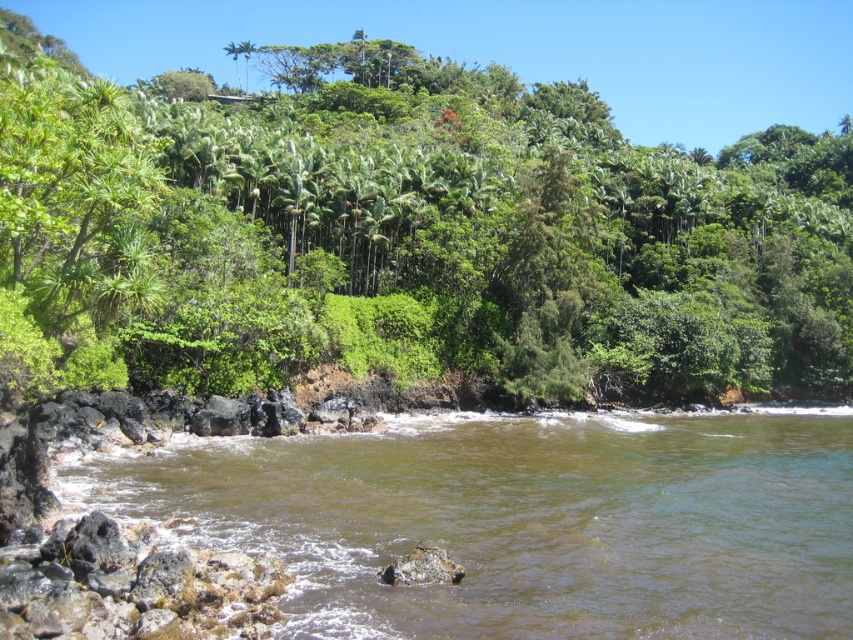
You are standing at the edge of the brown rocky river at lower left and want to reach the green leafy tree at upper center. Which direction should you move to get closer to the tree?

To reach the green leafy tree at upper center from the brown rocky river at lower left, you should move towards the upper center direction since the tree is positioned in front of the river, indicating it is closer to your current position.

You are a hiker who wants to take a photo of the green leafy tree at upper center and the brown rocky river at lower left. Which object should you focus on first if you want to capture both in one frame without moving the camera?

You should focus on the green leafy tree at upper center first because it is much taller than the brown rocky river at lower left, so it will occupy more space in the frame and ensure proper composition.